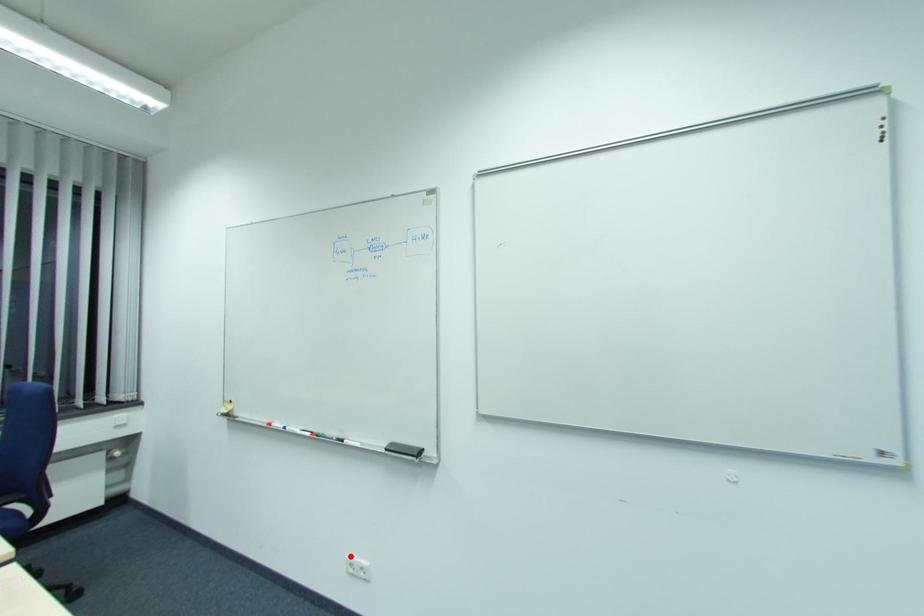
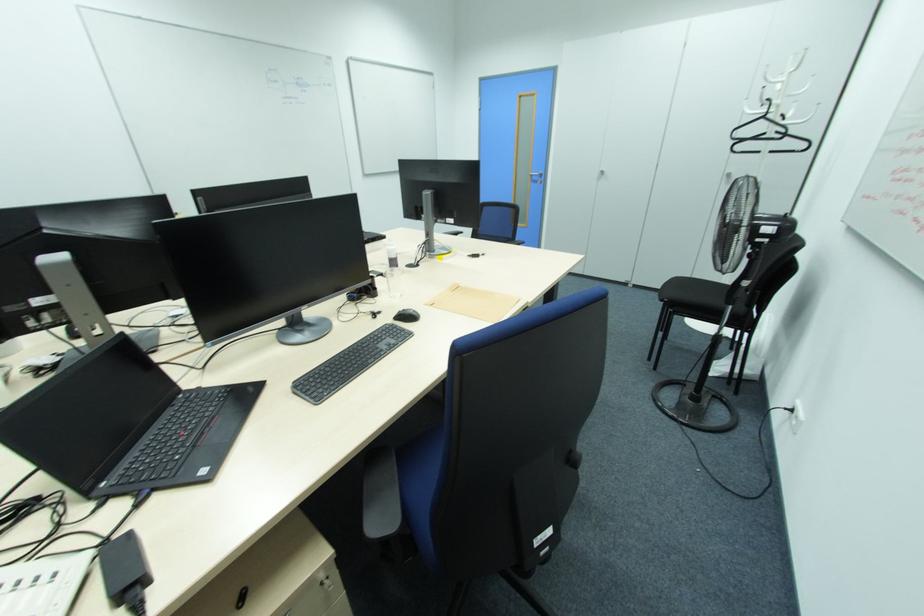
Question: I am providing you with two images of the same scene from different viewpoints. A red point is marked on the first image. At the location where the point appears in image 1, is it still visible in image 2?

Choices:
 (A) Yes
 (B) No

Answer: (B)